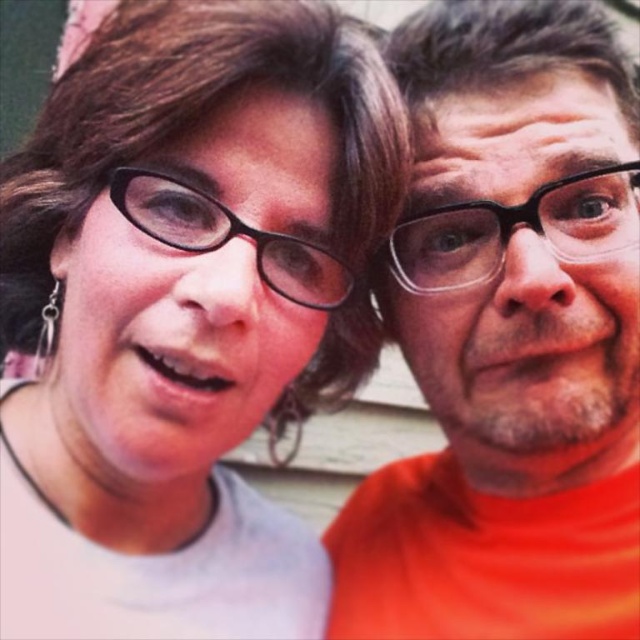
Question: Can you confirm if orange matte shirt at center is positioned above black plastic glasses at center?

Choices:
 (A) no
 (B) yes

Answer: (A)

Question: Estimate the real-world distances between objects in this image. Which object is farther from the matte black glasses at upper left?

Choices:
 (A) clear plastic glasses at center
 (B) orange matte shirt at center

Answer: (A)

Question: Considering the relative positions of clear plastic glasses at center and black plastic glasses at center in the image provided, where is clear plastic glasses at center located with respect to black plastic glasses at center?

Choices:
 (A) left
 (B) right

Answer: (B)

Question: Which point is closer to the camera?

Choices:
 (A) (144, 177)
 (B) (173, 356)
 (C) (445, 273)
 (D) (486, 177)

Answer: (B)

Question: Is matte black glasses at upper left thinner than black plastic glasses at center?

Choices:
 (A) no
 (B) yes

Answer: (A)

Question: Which of the following is the farthest from the observer?

Choices:
 (A) clear plastic glasses at center
 (B) black plastic glasses at center
 (C) matte black glasses at upper left

Answer: (A)